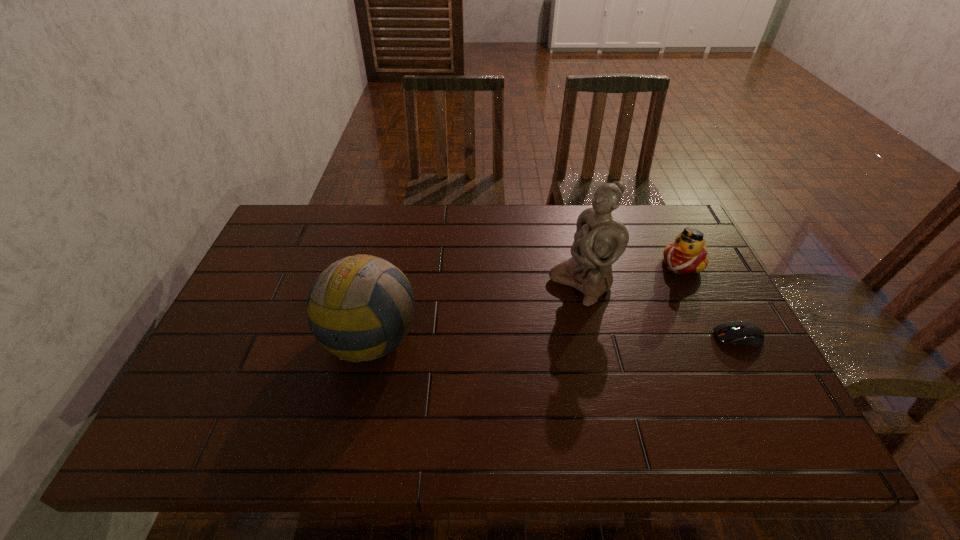
What are the coordinates of `volleyball` in the screenshot? It's located at (360, 305).

Where is `the third shortest object`? Image resolution: width=960 pixels, height=540 pixels. the third shortest object is located at coordinates (360, 305).

The width and height of the screenshot is (960, 540). Find the location of `the shortest object`. the shortest object is located at coordinates (745, 333).

In order to click on figurine in this screenshot , I will do `click(599, 240)`.

This screenshot has width=960, height=540. Find the location of `the tallest object`. the tallest object is located at coordinates (599, 240).

Locate an element on the screen. The height and width of the screenshot is (540, 960). the second shortest object is located at coordinates (688, 254).

Locate an element on the screen. vacant space situated on the left of the third shortest object is located at coordinates (241, 336).

At what (x,y) coordinates should I click in order to perform the action: click on vacant space situated on the button of the shortest object. Please return your answer as a coordinate pair (x, y). Looking at the image, I should click on (630, 337).

Where is `free location located 0.090m on the button of the shortest object`? Image resolution: width=960 pixels, height=540 pixels. free location located 0.090m on the button of the shortest object is located at coordinates (678, 337).

Image resolution: width=960 pixels, height=540 pixels. Find the location of `free region located 0.190m on the button of the shortest object`. free region located 0.190m on the button of the shortest object is located at coordinates (638, 337).